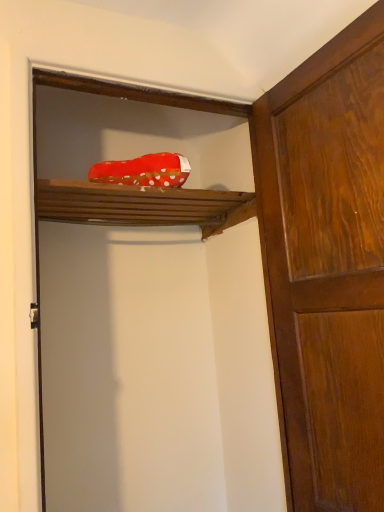
Question: Is red polka dot fabric at upper center not within wooden door at right, the 2th door viewed from the left?

Choices:
 (A) no
 (B) yes

Answer: (B)

Question: Is wooden door at right, positioned as the 1th door in right-to-left order, surrounded by red polka dot fabric at upper center?

Choices:
 (A) yes
 (B) no

Answer: (B)

Question: From the image's perspective, would you say red polka dot fabric at upper center is shown under wooden door at right, the 2th door viewed from the left?

Choices:
 (A) yes
 (B) no

Answer: (B)

Question: Is red polka dot fabric at upper center wider than wooden door at right, positioned as the 1th door in right-to-left order?

Choices:
 (A) no
 (B) yes

Answer: (B)

Question: Can you confirm if red polka dot fabric at upper center is shorter than wooden door at right, positioned as the 1th door in right-to-left order?

Choices:
 (A) yes
 (B) no

Answer: (A)

Question: Could you tell me if red polka dot fabric at upper center is turned towards wooden door at right, positioned as the 1th door in right-to-left order?

Choices:
 (A) no
 (B) yes

Answer: (A)

Question: Considering the relative positions of wooden door at upper center, which appears as the 1th door when viewed from the left, and red polka dot fabric at upper center in the image provided, is wooden door at upper center, which appears as the 1th door when viewed from the left, to the right of red polka dot fabric at upper center from the viewer's perspective?

Choices:
 (A) no
 (B) yes

Answer: (B)

Question: From a real-world perspective, does wooden door at upper center, the 2th door from the right, stand above red polka dot fabric at upper center?

Choices:
 (A) no
 (B) yes

Answer: (A)

Question: Is wooden door at upper center, which appears as the 1th door when viewed from the left, outside red polka dot fabric at upper center?

Choices:
 (A) no
 (B) yes

Answer: (B)

Question: Is red polka dot fabric at upper center a part of wooden door at upper center, the 2th door from the right?

Choices:
 (A) no
 (B) yes

Answer: (B)

Question: From the image's perspective, is wooden door at upper center, the 2th door from the right, under red polka dot fabric at upper center?

Choices:
 (A) no
 (B) yes

Answer: (B)

Question: Is wooden door at upper center, the 2th door from the right, facing towards red polka dot fabric at upper center?

Choices:
 (A) no
 (B) yes

Answer: (B)

Question: Would you say red polka dot fabric at center is a long distance from wooden door at upper center, the 2th door from the right?

Choices:
 (A) no
 (B) yes

Answer: (A)